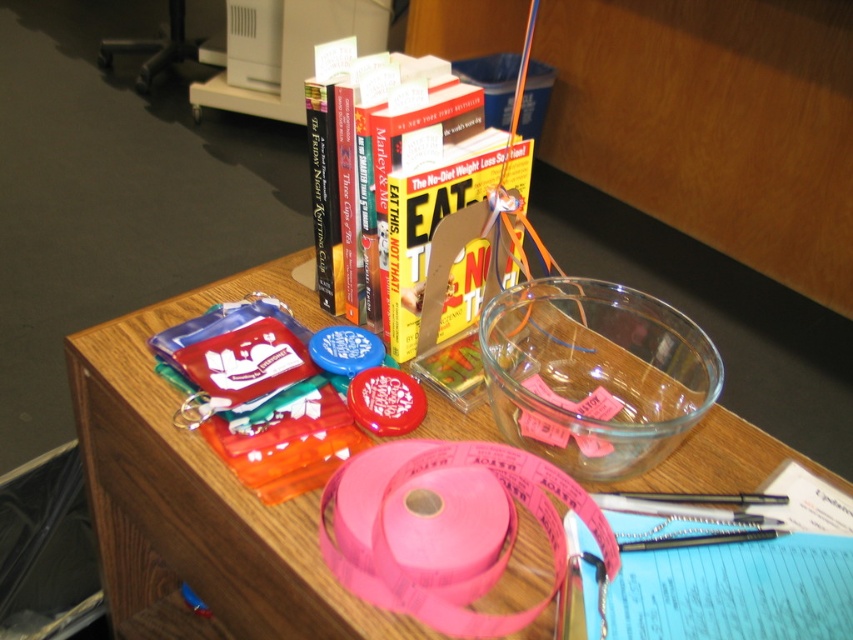
You are organizing items on a table and need to place a new item between the pink paper ribbon at center and the pink matte tape at center. Based on their positions, which side should you place the new item to ensure it is between them?

You should place the new item to the left of the pink paper ribbon at center and to the right of the pink matte tape at center since the pink paper ribbon at center is to the right of the pink matte tape at center.

You are organizing items on a table and need to place a new item exactly at the center of the table. However, there is already a pink paper ribbon at center. Where should you place the new item to ensure it is as close as possible to the center without overlapping the existing ribbon?

The pink paper ribbon at center is already located at the center of the table at point (445,529), so you should place the new item near that location but slightly offset to avoid overlapping.

You are organizing items on a table and need to determine which item is wider between the pink paper ribbon at center and the pink matte tape at center. Based on the arrangement shown, can you tell which one is wider?

The pink paper ribbon at center is wider than the pink matte tape at center according to the description provided.